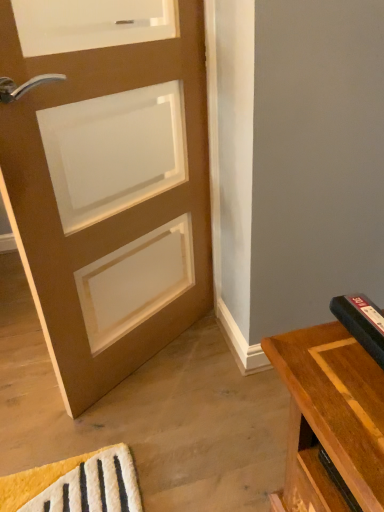
Locate an element on the screen. The image size is (384, 512). spots to the right of matte brown door at left is located at coordinates (216, 369).